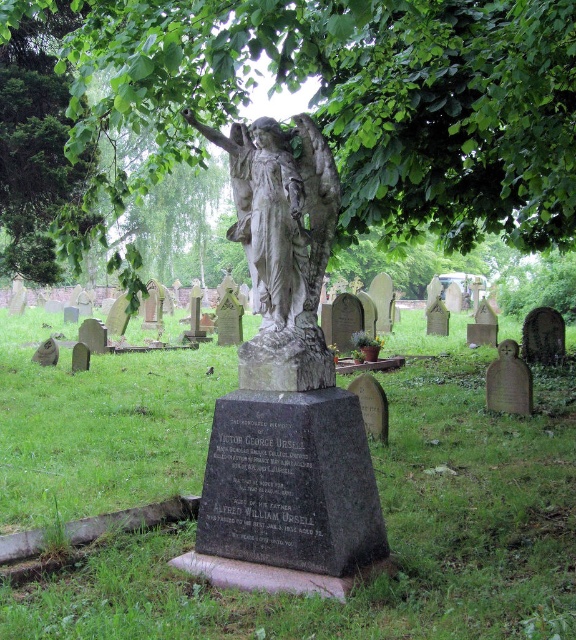
Question: Which of the following is the closest to the observer?

Choices:
 (A) white stone statue at center
 (B) green leafy tree at center
 (C) smooth gray stone at lower right

Answer: (A)

Question: Does green leafy tree at center have a greater width compared to smooth gray stone at lower right?

Choices:
 (A) no
 (B) yes

Answer: (B)

Question: Can you confirm if green leafy tree at center is smaller than smooth gray stone at lower right?

Choices:
 (A) no
 (B) yes

Answer: (A)

Question: Among these objects, which one is nearest to the camera?

Choices:
 (A) green leafy tree at center
 (B) white stone statue at center

Answer: (B)

Question: Estimate the real-world distances between objects in this image. Which object is closer to the smooth gray stone at lower right?

Choices:
 (A) green leafy tree at center
 (B) white stone statue at center

Answer: (A)

Question: Does green leafy tree at center appear over white stone statue at center?

Choices:
 (A) yes
 (B) no

Answer: (A)